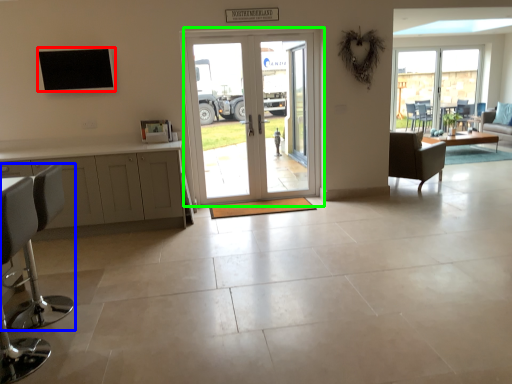
Question: Which is nearer to the window (highlighted by a red box)? chair (highlighted by a blue box) or door (highlighted by a green box).

Choices:
 (A) chair
 (B) door

Answer: (B)